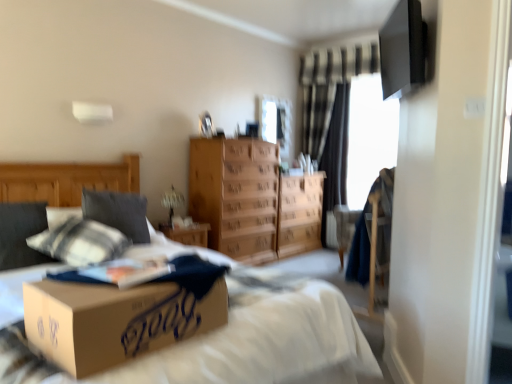
Question: Would you say soft gray pillow at left is outside wooden dresser at center?

Choices:
 (A) yes
 (B) no

Answer: (A)

Question: Can you confirm if soft gray pillow at left is positioned to the left of wooden dresser at center?

Choices:
 (A) yes
 (B) no

Answer: (A)

Question: Is wooden dresser at center surrounded by soft gray pillow at left?

Choices:
 (A) no
 (B) yes

Answer: (A)

Question: From a real-world perspective, is soft gray pillow at left under wooden dresser at center?

Choices:
 (A) no
 (B) yes

Answer: (A)

Question: Is soft gray pillow at left to the right of wooden dresser at center from the viewer's perspective?

Choices:
 (A) yes
 (B) no

Answer: (B)

Question: From the image's perspective, relative to transparent glass window screen at upper right, positioned as the 1th window screen in right-to-left order, is black textured curtain at center above or below?

Choices:
 (A) below
 (B) above

Answer: (A)

Question: Is black textured curtain at center in front of or behind transparent glass window screen at upper right, positioned as the 1th window screen in right-to-left order, in the image?

Choices:
 (A) front
 (B) behind

Answer: (B)

Question: Considering the positions of black textured curtain at center and transparent glass window screen at upper right, positioned as the 1th window screen in right-to-left order, in the image, is black textured curtain at center taller or shorter than transparent glass window screen at upper right, positioned as the 1th window screen in right-to-left order,?

Choices:
 (A) tall
 (B) short

Answer: (A)

Question: Is black textured curtain at center bigger or smaller than transparent glass window screen at upper right, the second window screen positioned from the left?

Choices:
 (A) big
 (B) small

Answer: (A)

Question: From the image's perspective, is transparent glass window screen at upper right, positioned as the 1th window screen in right-to-left order, above or below clear glass window screen at upper center, marked as the 2th window screen in a right-to-left arrangement?

Choices:
 (A) above
 (B) below

Answer: (B)

Question: Looking at their shapes, would you say transparent glass window screen at upper right, positioned as the 1th window screen in right-to-left order, is wider or thinner than clear glass window screen at upper center, the 1th window screen positioned from the left?

Choices:
 (A) thin
 (B) wide

Answer: (B)

Question: From their relative heights in the image, would you say transparent glass window screen at upper right, positioned as the 1th window screen in right-to-left order, is taller or shorter than clear glass window screen at upper center, the 1th window screen positioned from the left?

Choices:
 (A) short
 (B) tall

Answer: (B)

Question: From a real-world perspective, relative to clear glass window screen at upper center, the 1th window screen positioned from the left, is transparent glass window screen at upper right, the second window screen positioned from the left, vertically above or below?

Choices:
 (A) below
 (B) above

Answer: (A)

Question: From the image's perspective, is black textured curtain at center above or below clear glass window screen at upper center, the 1th window screen positioned from the left?

Choices:
 (A) below
 (B) above

Answer: (A)

Question: In the image, is black textured curtain at center on the left side or the right side of clear glass window screen at upper center, the 1th window screen positioned from the left?

Choices:
 (A) right
 (B) left

Answer: (A)